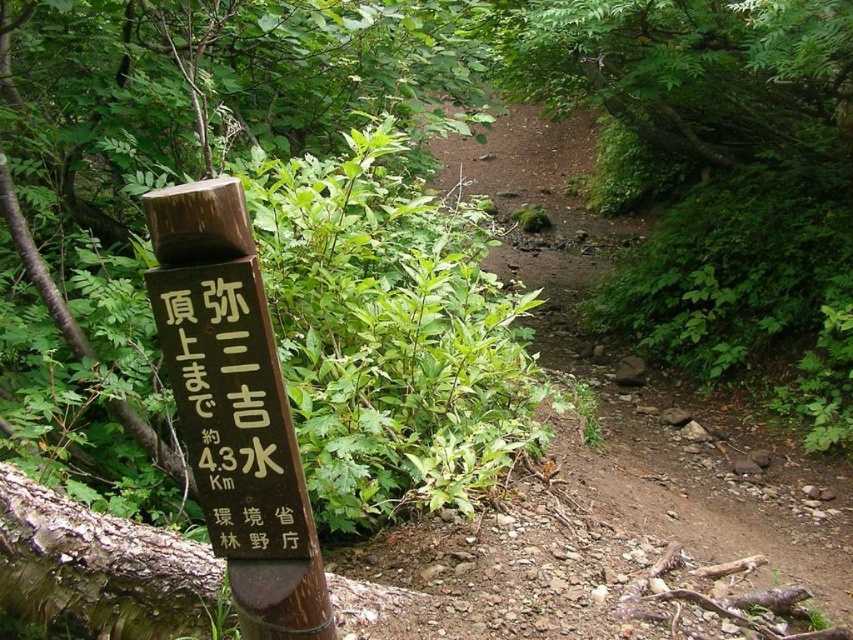
You are standing at the camera position looking at the wooden signpost with Japanese text in the foreground. There is a specific point marked at coordinates point [169,348]. If you want to touch this point with a stick that is 1.2 meters long, will the stick be long enough?

The point [169,348] is 1.39 meters away from the camera. Since the stick is only 1.2 meters long, it is not long enough to reach the point.